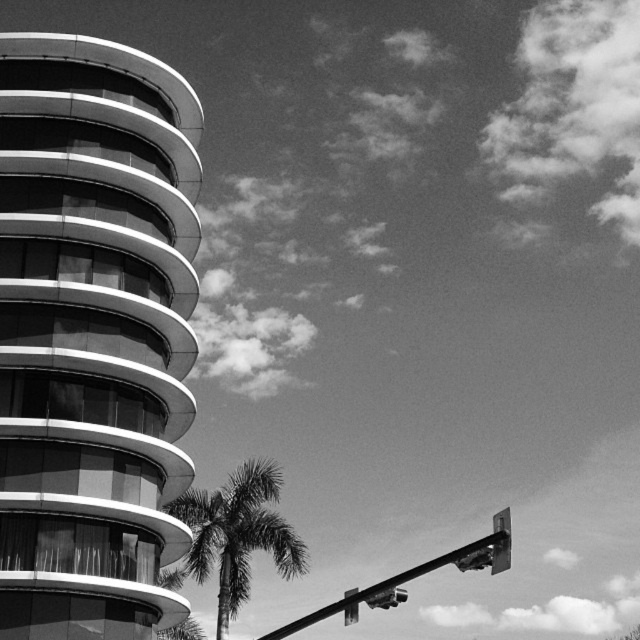
Question: Is silvery textured palm tree at center below metallic street sign at upper right?

Choices:
 (A) yes
 (B) no

Answer: (A)

Question: Is silvery textured palm tree at center below metallic street sign at upper right?

Choices:
 (A) no
 (B) yes

Answer: (B)

Question: Which point is closer to the camera?

Choices:
 (A) silvery textured palm tree at center
 (B) metallic street sign at upper right

Answer: (B)

Question: Is silvery textured palm tree at center bigger than metallic street sign at upper right?

Choices:
 (A) yes
 (B) no

Answer: (A)

Question: Which object appears closest to the camera in this image?

Choices:
 (A) silvery textured palm tree at center
 (B) metallic street sign at upper right

Answer: (B)